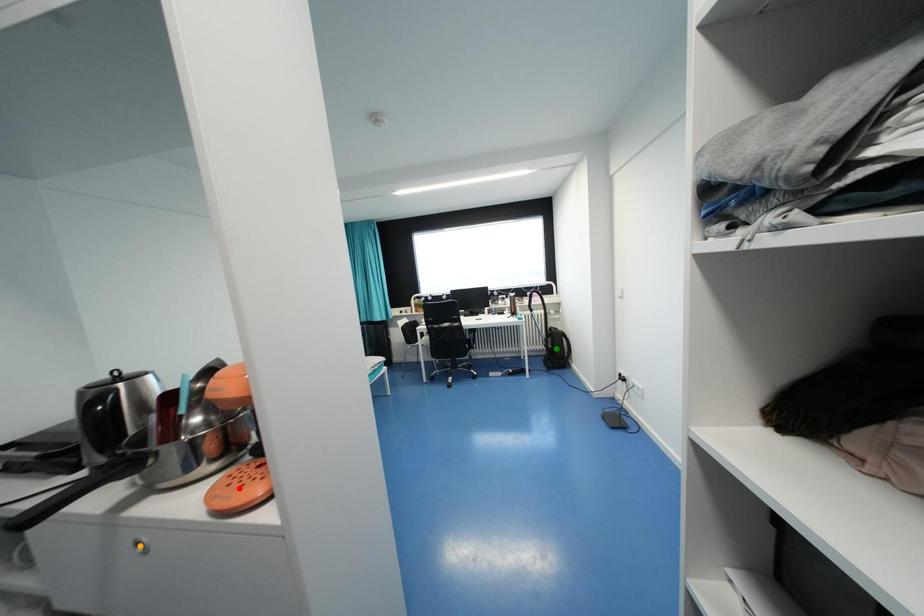
Order these from nearest to farthest:
green point, red point, orange point

1. red point
2. orange point
3. green point